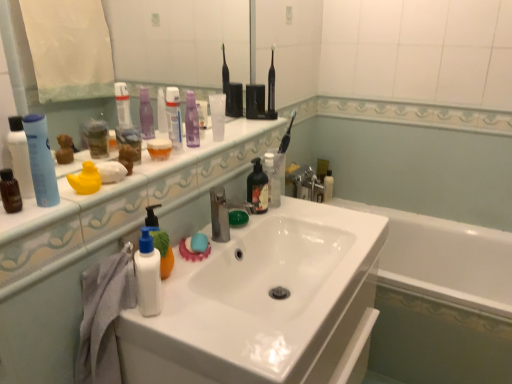
Locate an element on the screen. The image size is (512, 384). free spot behind translucent plastic cup at center, the 2th mouthwash in the front-to-back sequence is located at coordinates (183, 150).